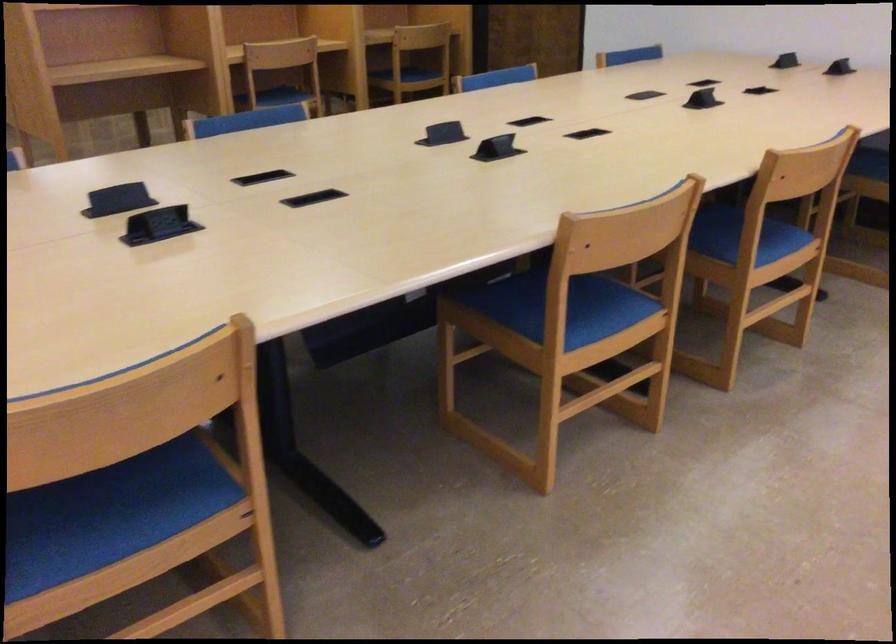
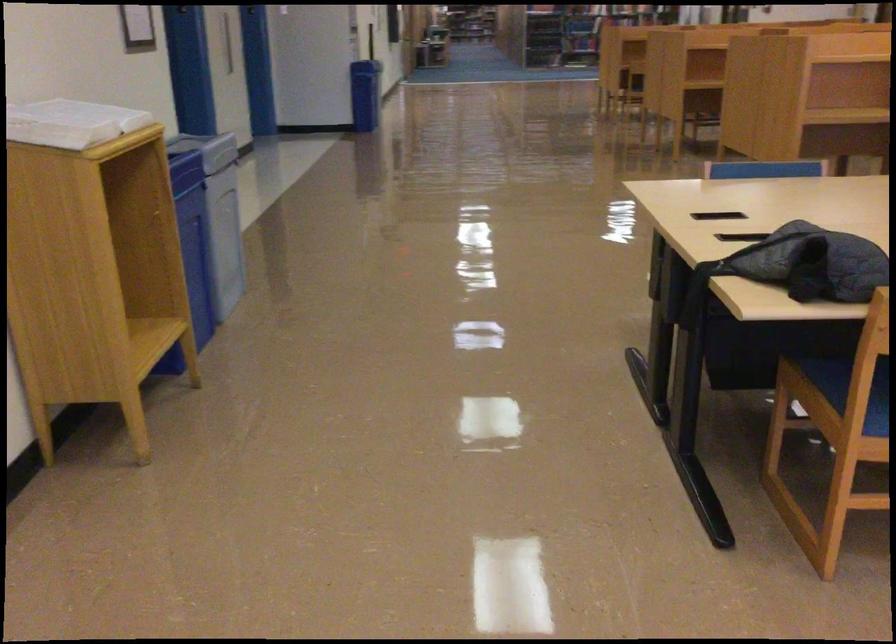
Question: The camera is either moving clockwise (left) or counter-clockwise (right) around the object. The first image is from the beginning of the video and the second image is from the end. Is the camera moving left or right when shooting the video?

Choices:
 (A) Left
 (B) Right

Answer: (B)